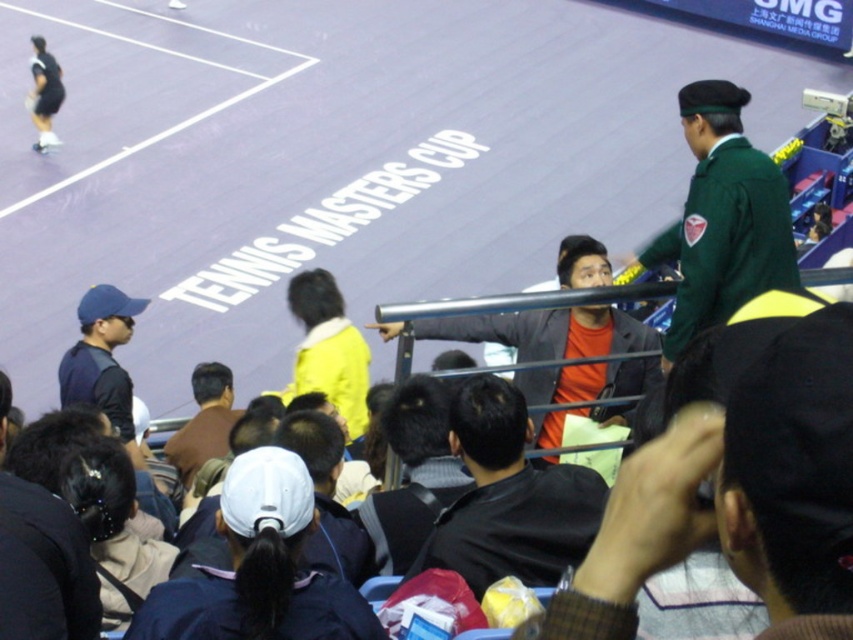
Is orange matte shirt at center further to the viewer compared to brown leather jacket at center?

No, it is not.

Between point (729, 481) and point (201, 429), which one is positioned behind?

Point (201, 429)

Is point (595, 621) positioned after point (219, 396)?

No, (595, 621) is in front of (219, 396).

Locate an element on the screen. Image resolution: width=853 pixels, height=640 pixels. orange matte shirt at center is located at coordinates (740, 493).

Which is more to the right, black leather jacket at center or brown leather jacket at center?

black leather jacket at center is more to the right.

Is point (514, 464) behind point (215, 406)?

No, it is not.

Where is `black leather jacket at center`? black leather jacket at center is located at coordinates (509, 497).

Does green uniform at upper right appear on the left side of dark blue cap at left?

Incorrect, green uniform at upper right is not on the left side of dark blue cap at left.

Can you confirm if green uniform at upper right is positioned above dark blue cap at left?

Yes, green uniform at upper right is above dark blue cap at left.

Who is more distant from viewer, [724,285] or [112,390]?

The point [112,390] is more distant.

The width and height of the screenshot is (853, 640). I want to click on green uniform at upper right, so click(x=722, y=218).